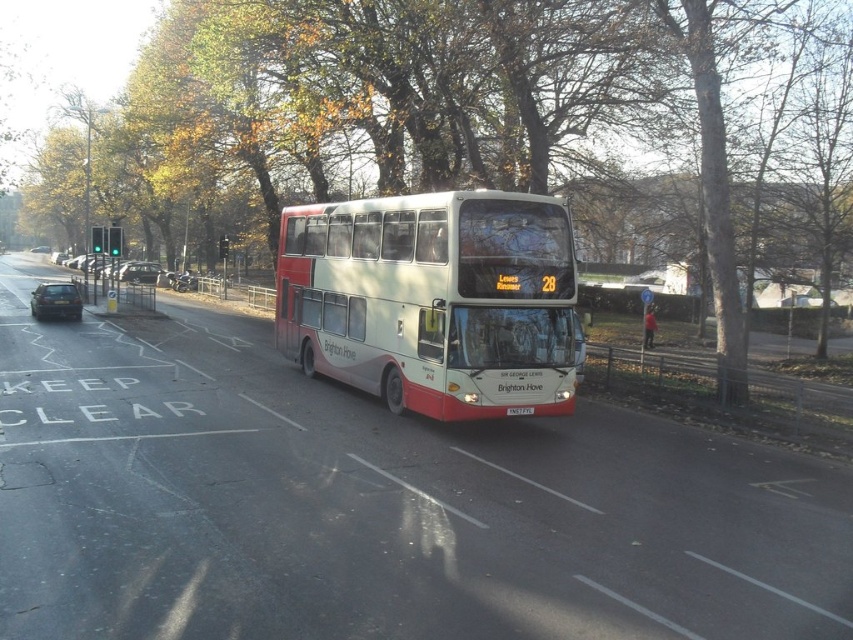
You are a pedestrian standing at the edge of the road where the green leafy tree at center and the white plastic license plate at center are located. You need to cross the road to reach the other side. Given that the distance between these two objects is 27.53 meters, and the speed limit here is 30 mph, can you safely cross the road without waiting for the bus to pass?

The distance between the green leafy tree at center and the white plastic license plate at center is 27.53 meters. However, the bus is traveling at the speed limit of 30 mph, which converts to approximately 13.41 meters per second. To cross 27.53 meters safely, a pedestrian would need about 2 seconds, but the bus would cover that distance in roughly 2 seconds as well. Therefore, it is not safe to cross without waiting for the bus to pass.